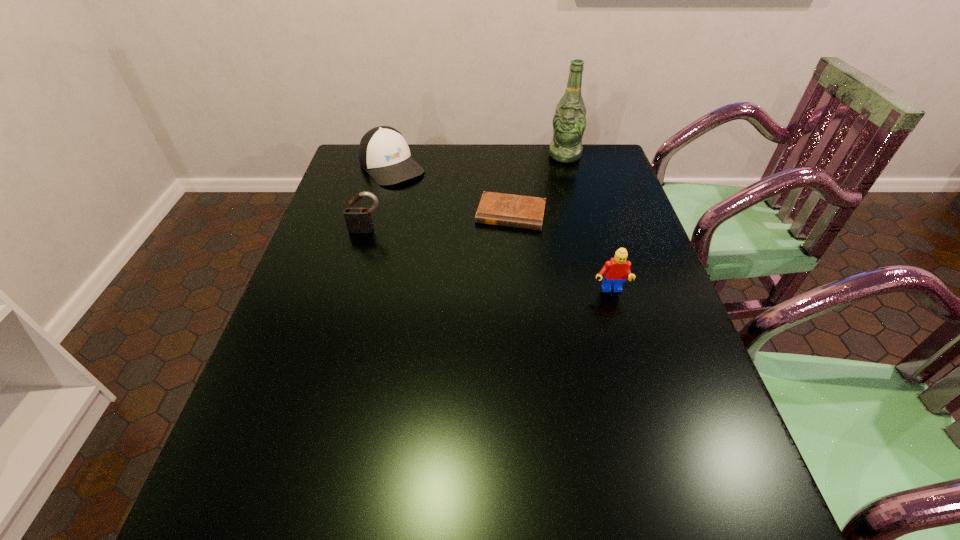
Locate an element on the screen. vacant space on the desktop that is between the padlock and the Lego and is positioned on the surface of the tallest object is located at coordinates (508, 265).

I want to click on free space on the desktop that is between the padlock and the Lego and is positioned on the front panel of the cap, so click(486, 260).

This screenshot has height=540, width=960. In order to click on free space on the desktop that is between the padlock and the nearest object and is positioned on the spine side of the shortest object in this screenshot , I will do `click(499, 263)`.